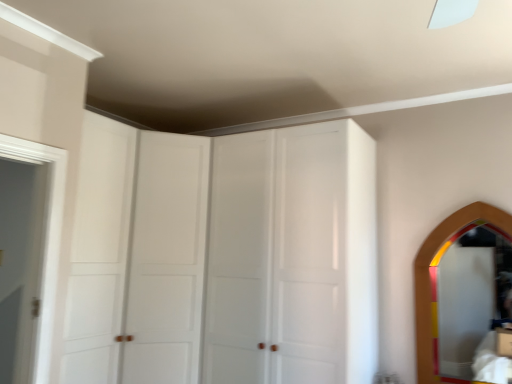
Question: From a real-world perspective, relative to wooden mirror at right, is white glossy cabinet doors at upper center, positioned as the first glass door in left-to-right order, vertically above or below?

Choices:
 (A) above
 (B) below

Answer: (A)

Question: Based on their positions, is white glossy cabinet doors at upper center, which is the second glass door from right to left, located to the left or right of wooden mirror at right?

Choices:
 (A) left
 (B) right

Answer: (A)

Question: Which object is the farthest from the white wooden door at left?

Choices:
 (A) white glossy cabinet at center, positioned as the 2th glass door in left-to-right order
 (B) white glossy cabinet doors at upper center, positioned as the first glass door in left-to-right order
 (C) wooden mirror at right

Answer: (C)

Question: Which of these objects is positioned closest to the wooden mirror at right?

Choices:
 (A) white glossy cabinet doors at upper center, which is the second glass door from right to left
 (B) white glossy cabinet at center, positioned as the 2th glass door in left-to-right order
 (C) white wooden door at left

Answer: (B)